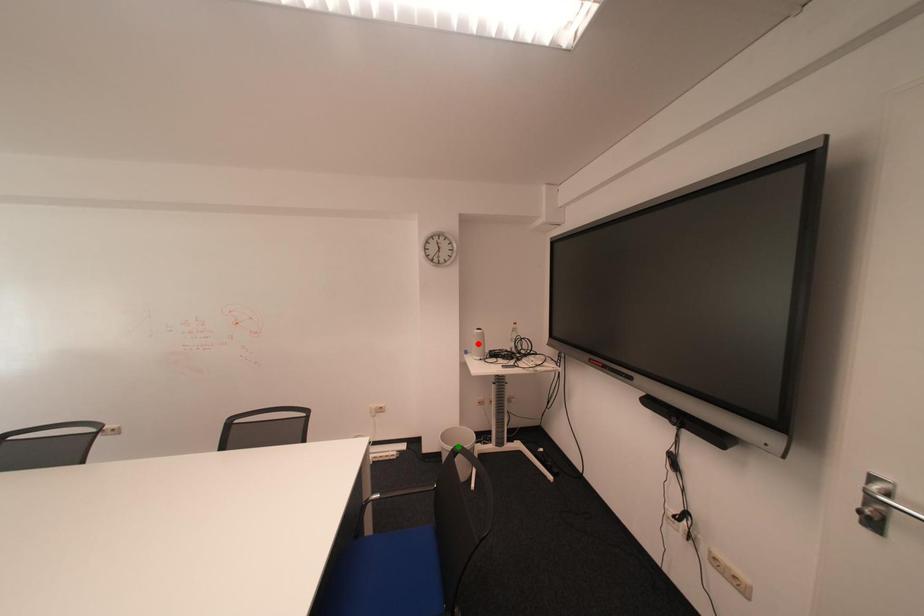
Based on the photo, order these from nearest to farthest:
orange point
green point
red point

1. orange point
2. red point
3. green point